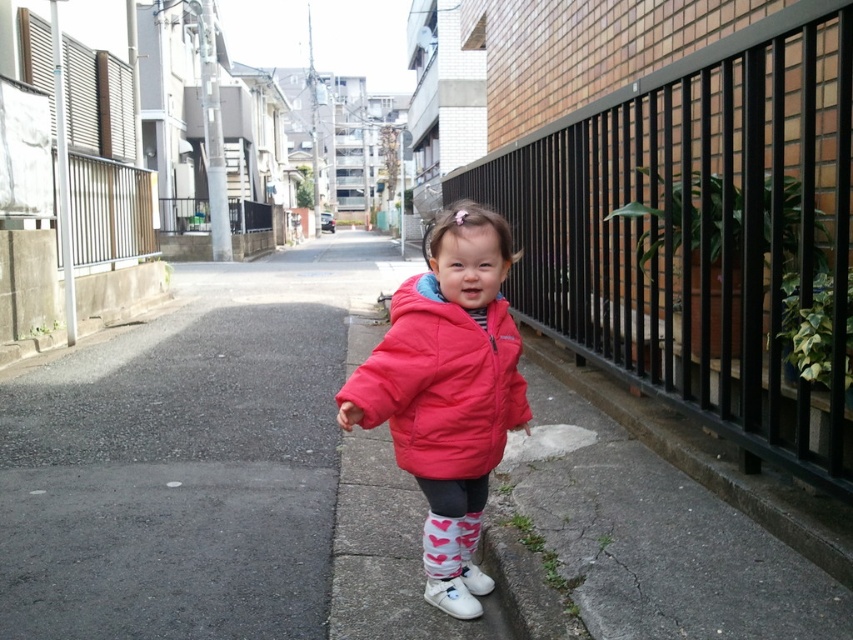
You are a drone operator who needs to deliver a small package to the child in the scene. The package must be placed at the exact coordinates of point (440, 384). Where should you aim the delivery to ensure it lands precisely on the child?

The point (440, 384) is located on the matte pink puffer jacket at center, so you should aim the delivery at the center of the child where the matte pink puffer jacket is located.

You are a delivery robot that needs to deliver a package to the gray asphalt pavement at center. You are currently at the matte pink puffer jacket at center. Can you reach the destination without moving more than 10 feet?

The gray asphalt pavement at center and matte pink puffer jacket at center are 8.68 feet apart from each other. Since 8.68 feet is less than 10 feet, the delivery robot can reach the destination without moving more than 10 feet.